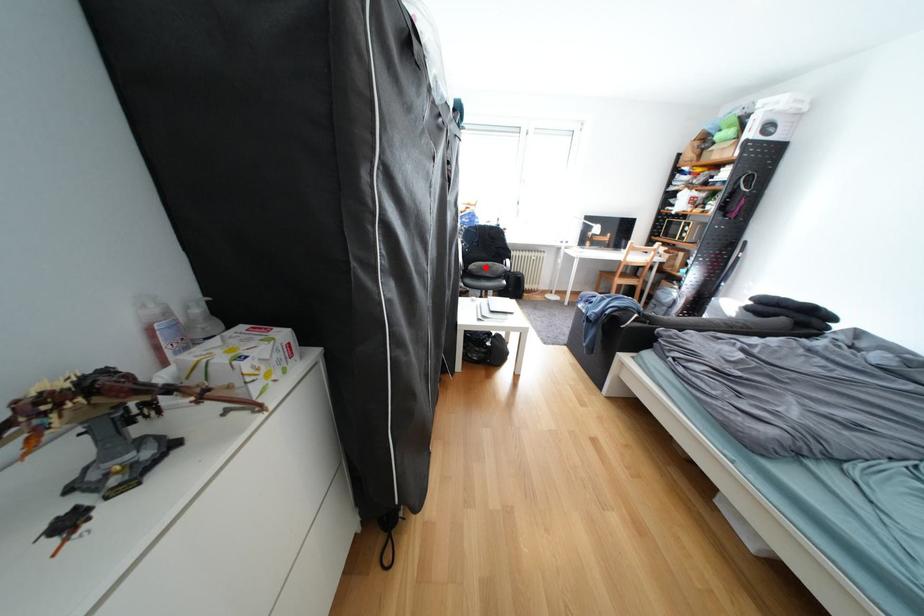
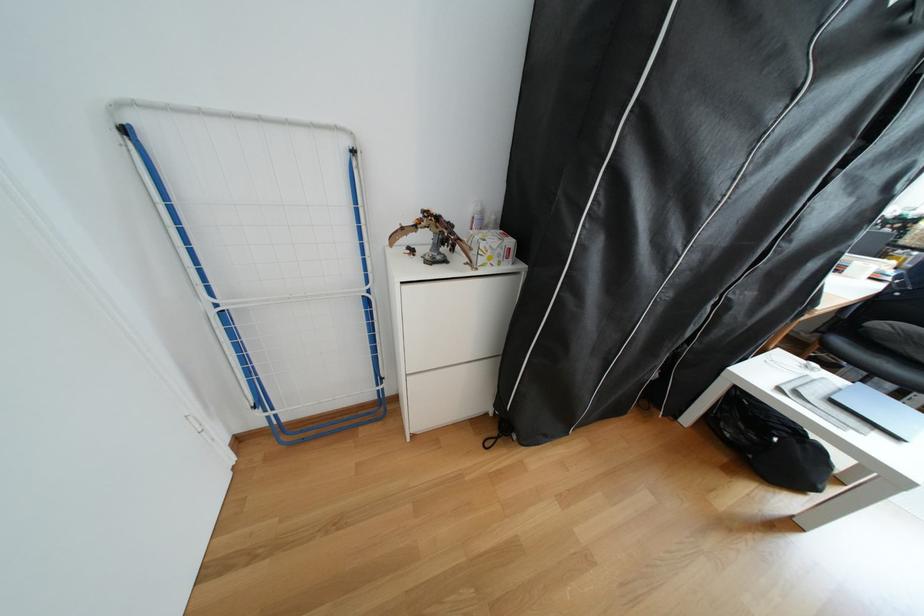
Question: A red point is marked in image1. In image2, is the corresponding 3D point closer to the camera or farther? Reply with the corresponding letter.

Choices:
 (A) The corresponding 3D point is closer.
 (B) The corresponding 3D point is farther.

Answer: (B)